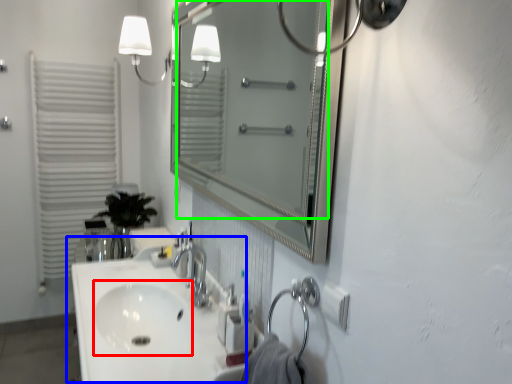
Question: Based on their relative distances, which object is nearer to sink (highlighted by a red box)? Choose from sink (highlighted by a blue box) and mirror (highlighted by a green box).

Choices:
 (A) sink
 (B) mirror

Answer: (A)